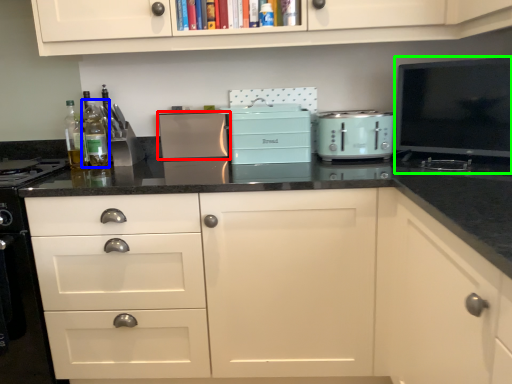
Question: Which object is the farthest from kitchen appliance (highlighted by a red box)? Choose among these: bottle (highlighted by a blue box) or appliance (highlighted by a green box).

Choices:
 (A) bottle
 (B) appliance

Answer: (B)